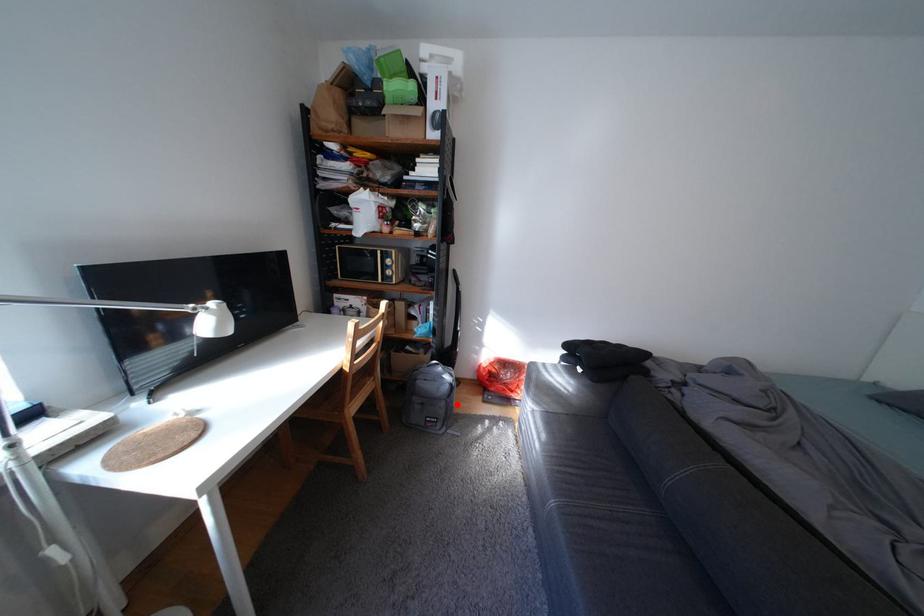
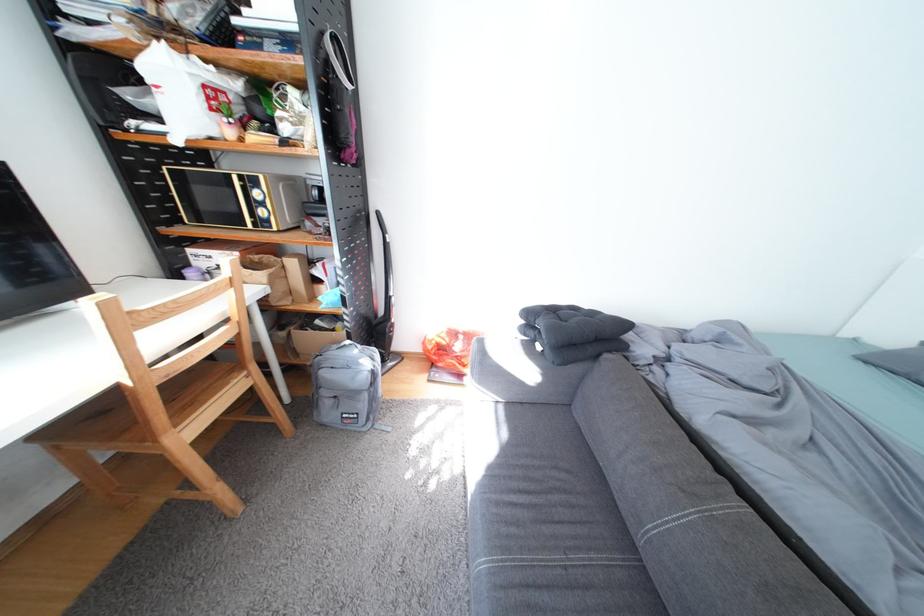
Locate, in the second image, the point that corresponds to the highlighted location in the first image.

(378, 397)